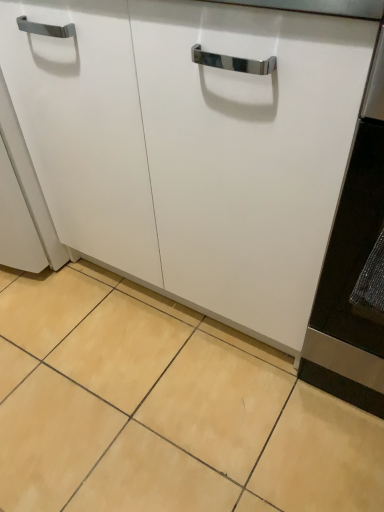
Question: Considering the relative positions of beige ceramic tile at lower center and white matte cabinet at center in the image provided, is beige ceramic tile at lower center in front of white matte cabinet at center?

Choices:
 (A) yes
 (B) no

Answer: (B)

Question: Is white matte cabinet at center at the back of beige ceramic tile at lower center?

Choices:
 (A) no
 (B) yes

Answer: (A)

Question: Can you confirm if beige ceramic tile at lower center is smaller than white matte cabinet at center?

Choices:
 (A) no
 (B) yes

Answer: (B)

Question: Does beige ceramic tile at lower center touch white matte cabinet at center?

Choices:
 (A) no
 (B) yes

Answer: (A)

Question: Considering the relative positions of beige ceramic tile at lower center and white matte cabinet at center in the image provided, is beige ceramic tile at lower center behind white matte cabinet at center?

Choices:
 (A) yes
 (B) no

Answer: (A)

Question: Is beige ceramic tile at lower center outside of white matte cabinet at center?

Choices:
 (A) no
 (B) yes

Answer: (B)

Question: Can you confirm if white matte cabinet at center is shorter than beige ceramic tile at lower center?

Choices:
 (A) no
 (B) yes

Answer: (A)

Question: Does white matte cabinet at center lie behind beige ceramic tile at lower center?

Choices:
 (A) no
 (B) yes

Answer: (A)

Question: Can you see white matte cabinet at center touching beige ceramic tile at lower center?

Choices:
 (A) no
 (B) yes

Answer: (A)

Question: Considering the relative positions of white matte cabinet at center and beige ceramic tile at lower center in the image provided, is white matte cabinet at center to the left of beige ceramic tile at lower center from the viewer's perspective?

Choices:
 (A) yes
 (B) no

Answer: (B)

Question: Does white matte cabinet at center have a greater height compared to beige ceramic tile at lower center?

Choices:
 (A) no
 (B) yes

Answer: (B)

Question: From the image's perspective, is white matte cabinet at center below beige ceramic tile at lower center?

Choices:
 (A) no
 (B) yes

Answer: (A)

Question: Considering the positions of white matte cabinet at center and beige ceramic tile at lower center in the image, is white matte cabinet at center wider or thinner than beige ceramic tile at lower center?

Choices:
 (A) wide
 (B) thin

Answer: (B)